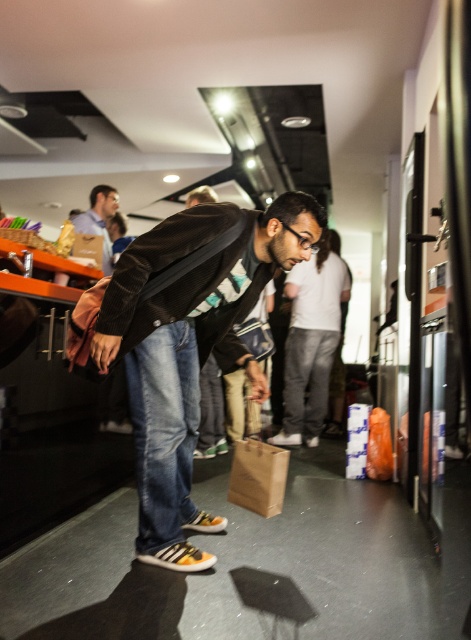
Looking at this image, is dark brown leather jacket at center to the left of matte blue shirt at upper left from the viewer's perspective?

Incorrect, dark brown leather jacket at center is not on the left side of matte blue shirt at upper left.

Is point (175, 396) closer to camera compared to point (97, 218)?

Yes, point (175, 396) is closer to viewer.

Where is `dark brown leather jacket at center`? dark brown leather jacket at center is located at coordinates (189, 348).